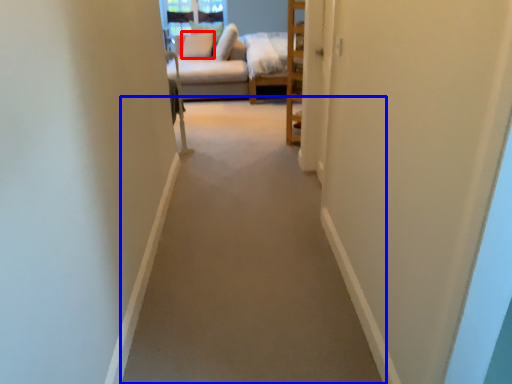
Question: Which object appears closest to the camera in this image, pillow (highlighted by a red box) or path (highlighted by a blue box)?

Choices:
 (A) pillow
 (B) path

Answer: (B)